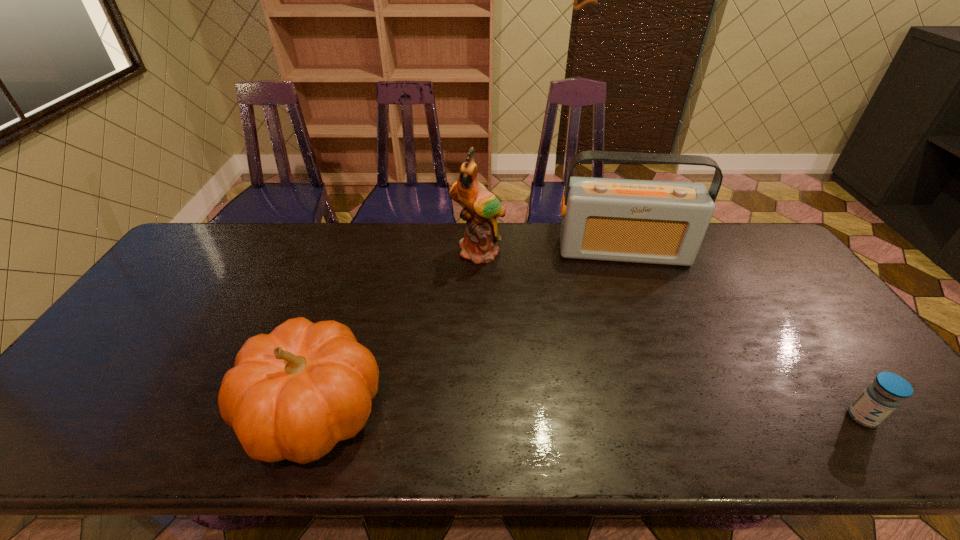
Locate an element on the screen. vacant space located on the front-facing side of the parrot is located at coordinates (489, 286).

At what (x,y) coordinates should I click in order to perform the action: click on free space located 0.120m on the front-facing side of the third object from left to right. Please return your answer as a coordinate pair (x, y). Looking at the image, I should click on (628, 294).

This screenshot has width=960, height=540. Find the location of `vacant space located on the front-facing side of the third object from left to right`. vacant space located on the front-facing side of the third object from left to right is located at coordinates (629, 296).

Identify the location of vacant space located on the front-facing side of the third object from left to right. The image size is (960, 540). (633, 315).

Where is `parrot at the far edge`? Image resolution: width=960 pixels, height=540 pixels. parrot at the far edge is located at coordinates (482, 208).

Where is `radio receiver at the far edge`? radio receiver at the far edge is located at coordinates (640, 221).

At what (x,y) coordinates should I click in order to perform the action: click on pumpkin present at the near edge. Please return your answer as a coordinate pair (x, y). This screenshot has height=540, width=960. Looking at the image, I should click on (293, 394).

Image resolution: width=960 pixels, height=540 pixels. What are the coordinates of `medicine located at the near edge` in the screenshot? It's located at (886, 393).

In order to click on object that is positioned at the right edge in this screenshot , I will do `click(886, 393)`.

The image size is (960, 540). What are the coordinates of `object present at the near right corner` in the screenshot? It's located at (886, 393).